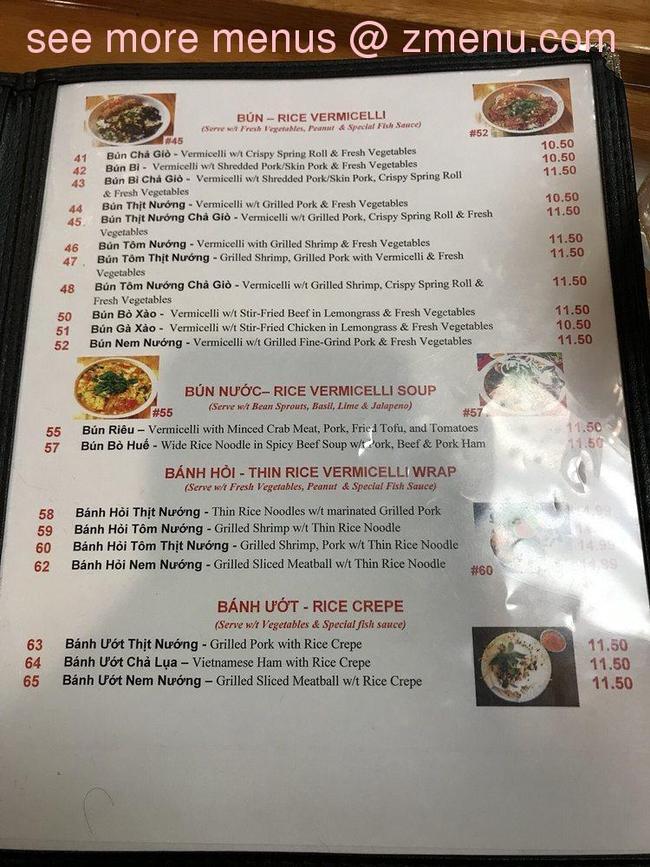
Locate an element on the screen. The width and height of the screenshot is (650, 867). reflection of light on menu page is located at coordinates pyautogui.click(x=608, y=505).